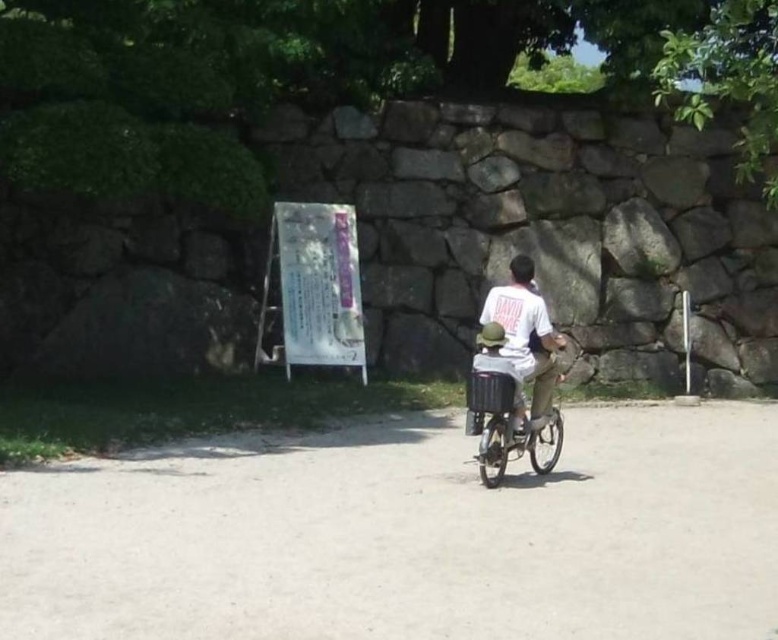
Who is taller, metallic silver tricycle at center or white cotton shirt at center?

Standing taller between the two is white cotton shirt at center.

Between metallic silver tricycle at center and white cotton shirt at center, which one appears on the right side from the viewer's perspective?

white cotton shirt at center

Which is behind, point (482, 433) or point (517, 266)?

Point (517, 266)

Locate an element on the screen. metallic silver tricycle at center is located at coordinates (503, 420).